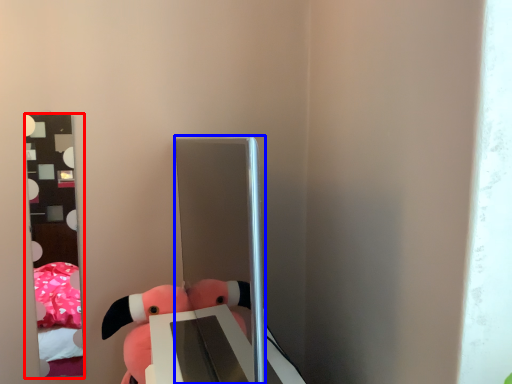
Question: Among these objects, which one is nearest to the camera, mirror (highlighted by a red box) or glass door (highlighted by a blue box)?

Choices:
 (A) mirror
 (B) glass door

Answer: (B)